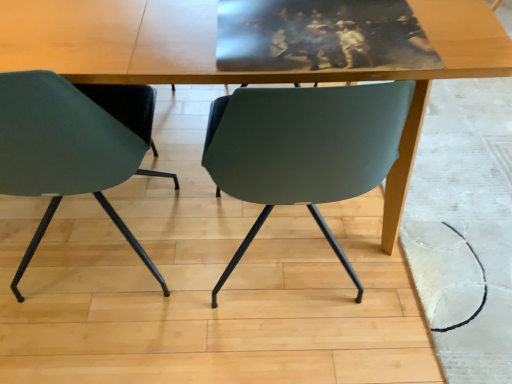
Question: In the image, is wooden table at center on the left side or the right side of matte green chair at left?

Choices:
 (A) right
 (B) left

Answer: (A)

Question: Is wooden table at center bigger or smaller than matte green chair at left?

Choices:
 (A) small
 (B) big

Answer: (B)

Question: From the image's perspective, is wooden table at center above or below matte green chair at left?

Choices:
 (A) below
 (B) above

Answer: (B)

Question: Visually, is matte green chair at left positioned to the left or to the right of wooden table at center?

Choices:
 (A) left
 (B) right

Answer: (A)

Question: Is matte green chair at left bigger or smaller than wooden table at center?

Choices:
 (A) big
 (B) small

Answer: (B)

Question: From a real-world perspective, is matte green chair at left physically located above or below wooden table at center?

Choices:
 (A) below
 (B) above

Answer: (B)

Question: Considering their positions, is matte green chair at left located in front of or behind wooden table at center?

Choices:
 (A) behind
 (B) front

Answer: (B)